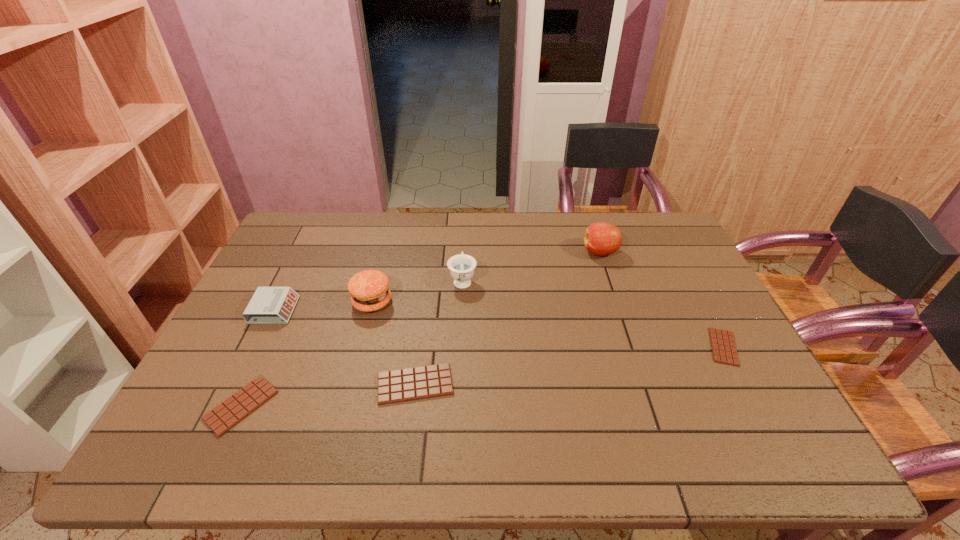
Locate an element on the screen. This screenshot has width=960, height=540. free space between the sixth tallest object and the fifth object from right to left is located at coordinates (307, 354).

Identify which object is the fourth nearest to the rightmost candy bar. Please provide its 2D coordinates. Your answer should be formatted as a tuple, i.e. [(x, y)], where the tuple contains the x and y coordinates of a point satisfying the conditions above.

[(369, 290)]

Locate an element on the screen. The height and width of the screenshot is (540, 960). object that is the fourth closest to the patty is located at coordinates (230, 412).

Locate an element on the screen. This screenshot has height=540, width=960. candy bar identified as the second closest to the rightmost object is located at coordinates pos(230,412).

Identify which candy bar is the nearest to the sixth tallest object. Please provide its 2D coordinates. Your answer should be formatted as a tuple, i.e. [(x, y)], where the tuple contains the x and y coordinates of a point satisfying the conditions above.

[(410, 384)]

You are a GUI agent. You are given a task and a screenshot of the screen. Output one action in this format:
    pyautogui.click(x=<x>, y=<y>)
    Task: Click on the vacant space that satisfies the following two spatial constraints: 1. on the side of the tallest object with the handle; 2. on the right side of the teacup
    
    Given the screenshot: What is the action you would take?
    coord(464,252)